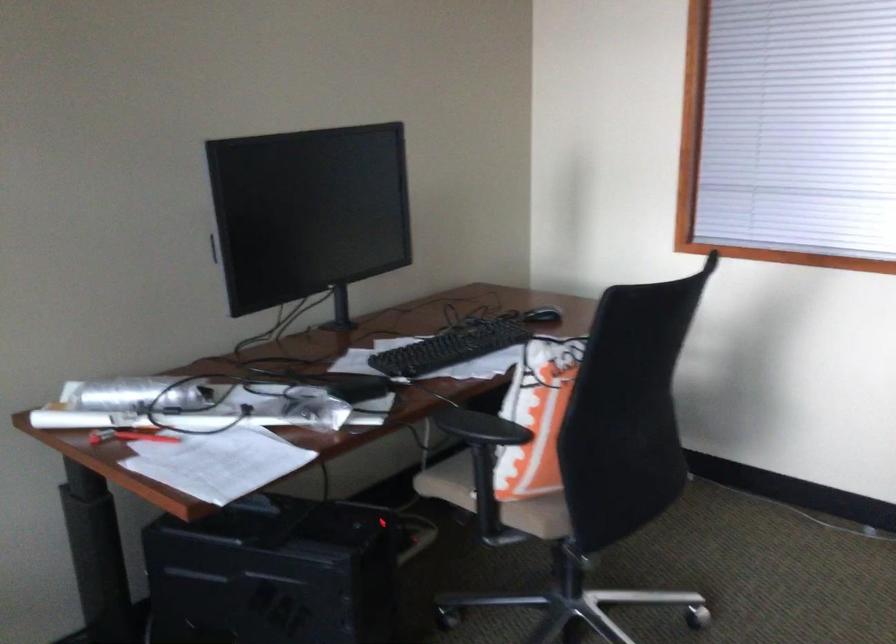
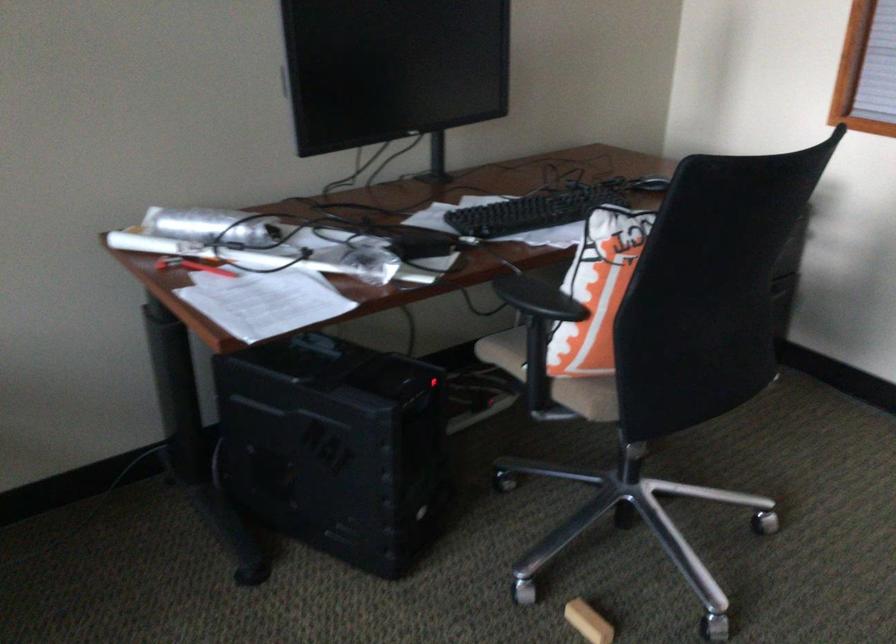
Locate, in the second image, the point that corresponds to [451,348] in the first image.

(532, 211)